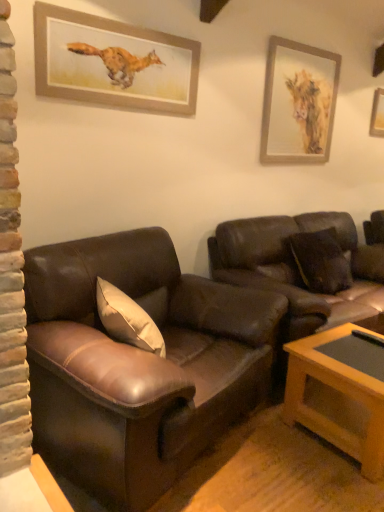
Question: From a real-world perspective, is wooden picture frame at upper right, which is the 1th picture frame from right to left, under wooden picture frame at upper left, the third picture frame in the back-to-front sequence?

Choices:
 (A) yes
 (B) no

Answer: (B)

Question: Is wooden picture frame at upper right, the 3th picture frame in the left-to-right sequence, aimed at wooden picture frame at upper left, the 3th picture frame in the right-to-left sequence?

Choices:
 (A) yes
 (B) no

Answer: (B)

Question: Can you confirm if wooden picture frame at upper right, which appears as the third picture frame when viewed from the front, is smaller than wooden picture frame at upper left, the third picture frame in the back-to-front sequence?

Choices:
 (A) yes
 (B) no

Answer: (A)

Question: Is wooden picture frame at upper right, the 3th picture frame in the left-to-right sequence, shorter than wooden picture frame at upper left, the third picture frame in the back-to-front sequence?

Choices:
 (A) no
 (B) yes

Answer: (B)

Question: Can you confirm if wooden picture frame at upper right, which is the 1th picture frame from right to left, is positioned to the left of wooden picture frame at upper left, the third picture frame in the back-to-front sequence?

Choices:
 (A) no
 (B) yes

Answer: (A)

Question: Relative to wooden picture frame at upper right, the 3th picture frame in the left-to-right sequence, is brown leather couch at center, acting as the second studio couch starting from the left, in front or behind?

Choices:
 (A) front
 (B) behind

Answer: (A)

Question: Would you say brown leather couch at center, acting as the second studio couch starting from the left, is to the left or to the right of wooden picture frame at upper right, the 3th picture frame in the left-to-right sequence, in the picture?

Choices:
 (A) right
 (B) left

Answer: (B)

Question: Is brown leather couch at center, the first studio couch viewed from the right, inside the boundaries of wooden picture frame at upper right, which appears as the third picture frame when viewed from the front, or outside?

Choices:
 (A) outside
 (B) inside

Answer: (A)

Question: Considering the positions of brown leather couch at center, the first studio couch viewed from the right, and wooden picture frame at upper right, the 3th picture frame in the left-to-right sequence, in the image, is brown leather couch at center, the first studio couch viewed from the right, taller or shorter than wooden picture frame at upper right, the 3th picture frame in the left-to-right sequence,?

Choices:
 (A) short
 (B) tall

Answer: (B)

Question: Is wooden picture frame at upper left, the third picture frame in the back-to-front sequence, in front of or behind wooden picture frame at upper right, which appears as the third picture frame when viewed from the front, in the image?

Choices:
 (A) behind
 (B) front

Answer: (B)

Question: Is point (76, 35) closer or farther from the camera than point (380, 106)?

Choices:
 (A) closer
 (B) farther

Answer: (A)

Question: Considering the relative positions of wooden picture frame at upper left, acting as the first picture frame starting from the left, and wooden picture frame at upper right, which is the 1th picture frame from right to left, in the image provided, is wooden picture frame at upper left, acting as the first picture frame starting from the left, to the left or to the right of wooden picture frame at upper right, which is the 1th picture frame from right to left,?

Choices:
 (A) right
 (B) left

Answer: (B)

Question: Is wooden picture frame at upper left, which ranks as the 1th picture frame in front-to-back order, taller or shorter than wooden picture frame at upper right, which is counted as the first picture frame, starting from the back?

Choices:
 (A) short
 (B) tall

Answer: (B)

Question: From a real-world perspective, is wooden coffee table at lower right positioned above or below brown leather couch at center, acting as the second studio couch starting from the left?

Choices:
 (A) above
 (B) below

Answer: (B)

Question: Is wooden coffee table at lower right taller or shorter than brown leather couch at center, acting as the second studio couch starting from the left?

Choices:
 (A) tall
 (B) short

Answer: (B)